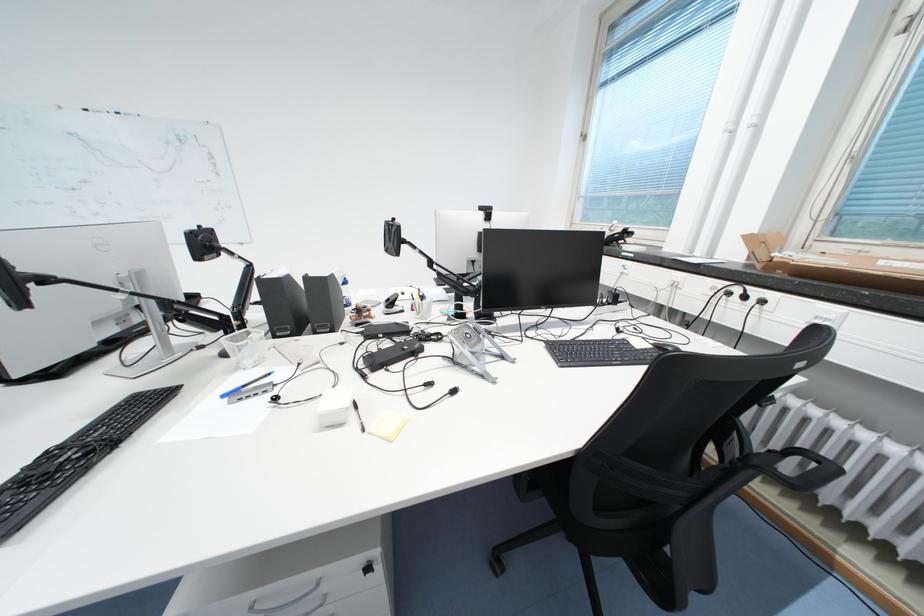
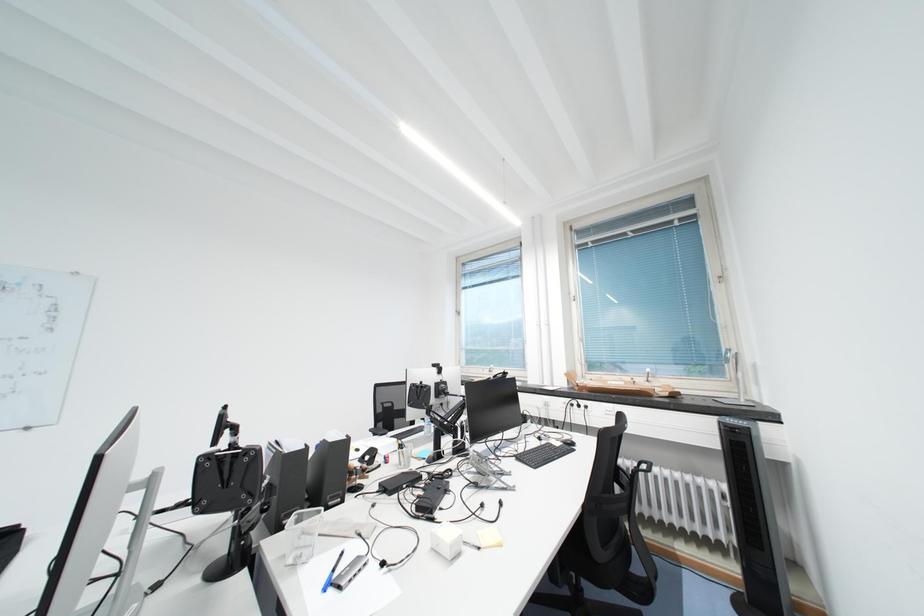
The images are taken continuously from a first-person perspective. In which direction is your viewpoint rotating?

The camera rotated toward right-up.